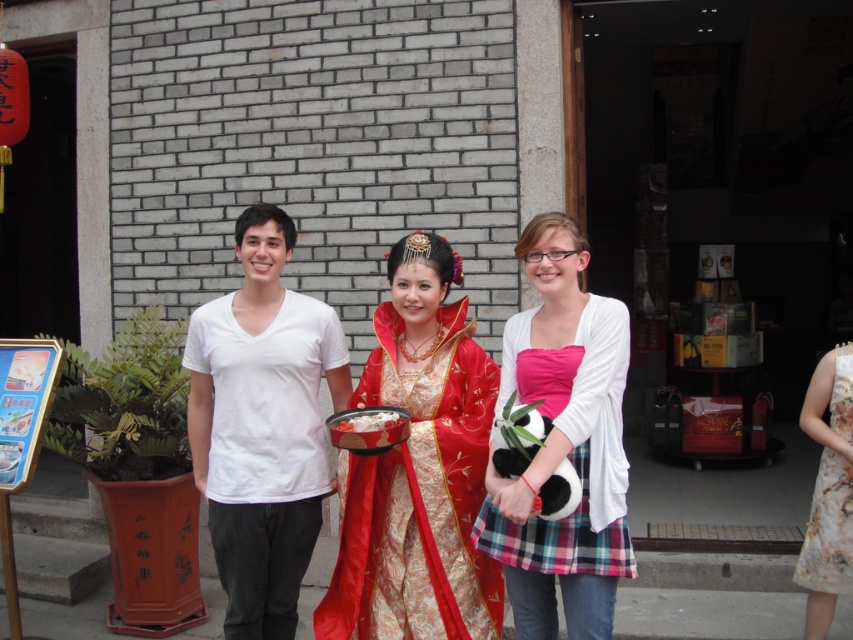
Question: Considering the real-world distances, which object is farthest from the floral silk dress at right?

Choices:
 (A) pink fabric dress at center
 (B) smooth glossy bowl at center

Answer: (B)

Question: Which object is positioned closest to the matte gold dress at center?

Choices:
 (A) smooth glossy bowl at center
 (B) floral silk dress at right
 (C) pink fabric dress at center

Answer: (C)

Question: Which object is closer to the camera taking this photo?

Choices:
 (A) matte gold dress at center
 (B) pink fabric dress at center

Answer: (B)

Question: Can you confirm if pink fabric dress at center is positioned to the right of floral silk dress at right?

Choices:
 (A) no
 (B) yes

Answer: (A)

Question: Does matte gold dress at center come behind white matte t-shirt at center?

Choices:
 (A) no
 (B) yes

Answer: (A)

Question: Can you confirm if pink fabric dress at center is thinner than smooth glossy bowl at center?

Choices:
 (A) no
 (B) yes

Answer: (A)